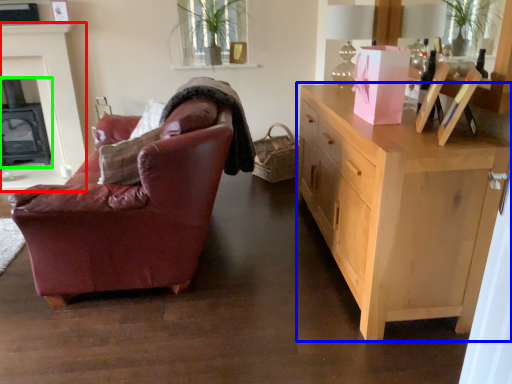
Question: Which is farther away from fireplace (highlighted by a red box)? cabinetry (highlighted by a blue box) or fireplace (highlighted by a green box)?

Choices:
 (A) cabinetry
 (B) fireplace

Answer: (A)